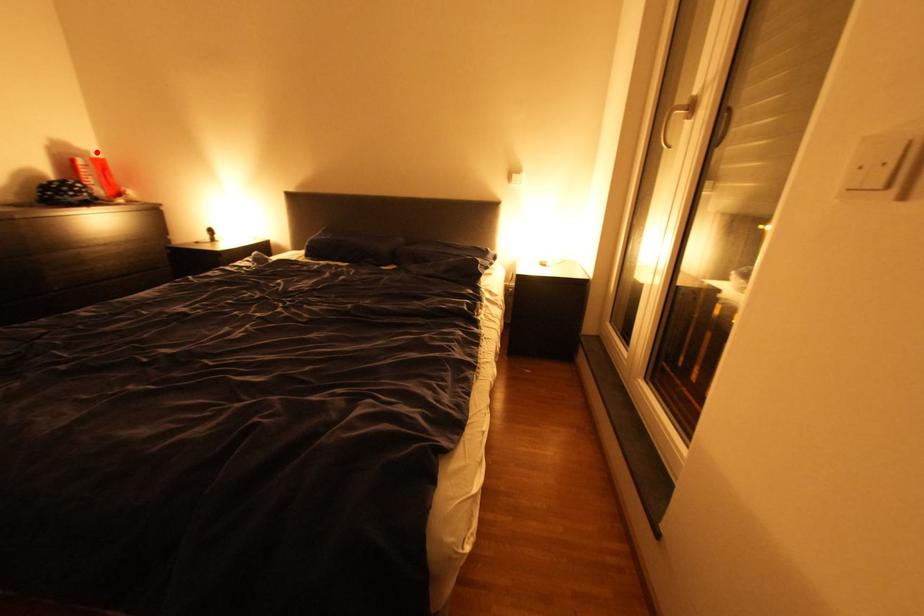
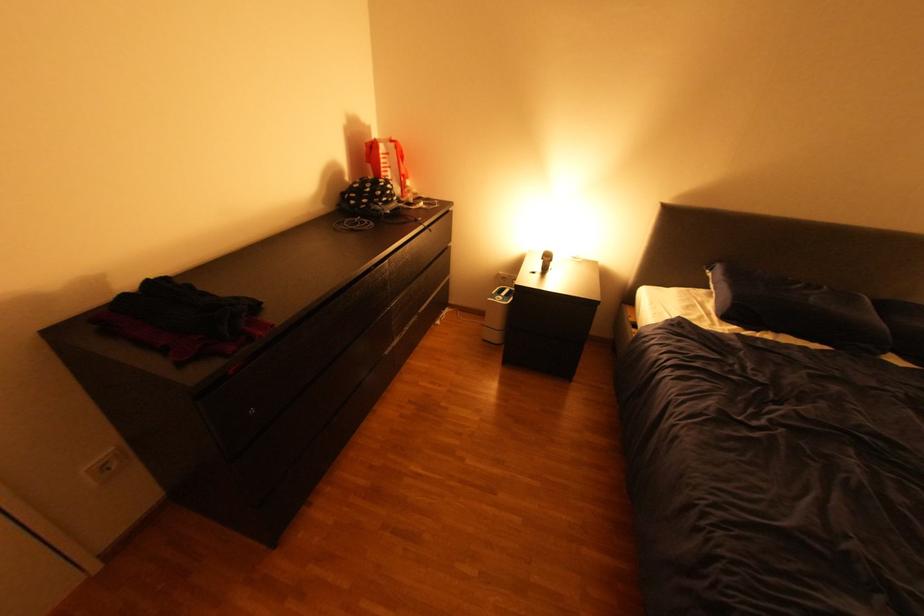
Question: I am providing you with two images of the same scene from different viewpoints. Given a red point in image1, look at the same physical point in image2. Is it:

Choices:
 (A) Closer to the viewpoint
 (B) Farther from the viewpoint

Answer: (A)